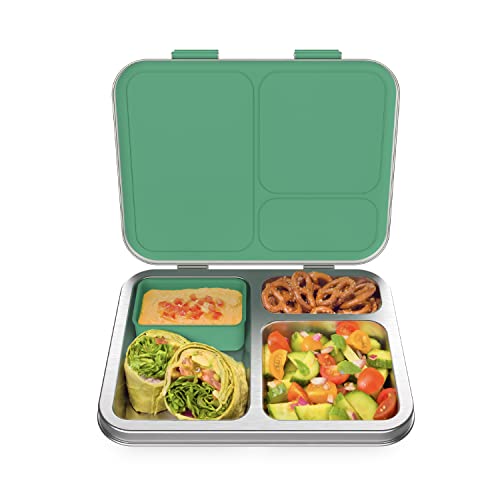
Where is `tray`? The image size is (500, 500). tray is located at coordinates (254, 417).